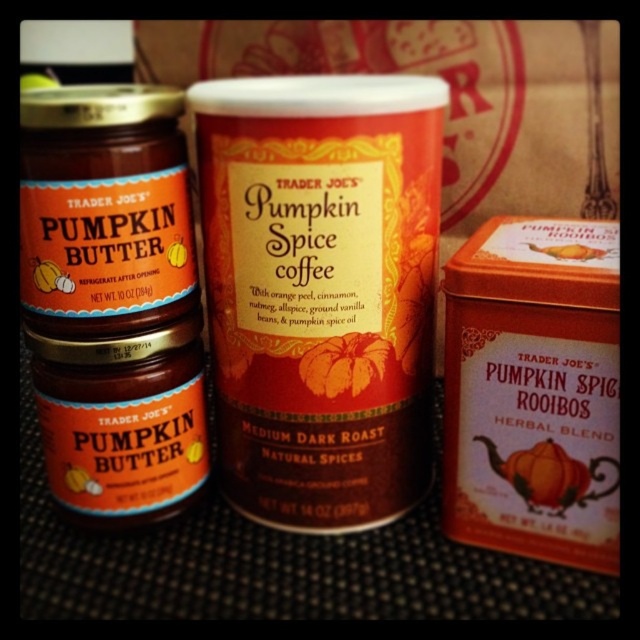
Question: Where is matte orange tin at center right located in relation to orange matte pumpkin spice rooibos herbal blend at center in the image?

Choices:
 (A) left
 (B) right

Answer: (A)

Question: Which of the following is the farthest from the observer?

Choices:
 (A) (561, 246)
 (B) (536, 477)

Answer: (B)

Question: Does matte orange tin at center right come in front of orange matte pumpkin spice rooibos herbal blend at center?

Choices:
 (A) yes
 (B) no

Answer: (B)

Question: Which of the following is the closest to the observer?

Choices:
 (A) orange matte pumpkin spice rooibos herbal blend at center
 (B) matte orange tin at center right

Answer: (A)

Question: Is matte orange tin at center right behind orange matte pumpkin spice rooibos herbal blend at center?

Choices:
 (A) no
 (B) yes

Answer: (B)

Question: Which point is closer to the camera taking this photo?

Choices:
 (A) (576, 250)
 (B) (592, 461)

Answer: (A)